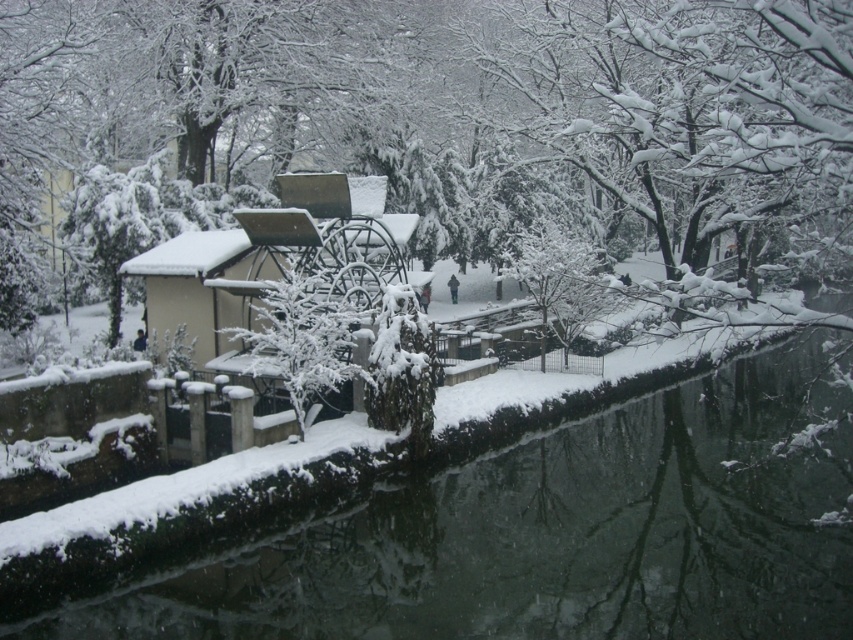
Describe the element at coordinates (555, 536) in the screenshot. I see `snowy concrete river at lower left` at that location.

Can you confirm if snowy concrete river at lower left is thinner than white matte watermill at center?

No, snowy concrete river at lower left is not thinner than white matte watermill at center.

Who is more forward, (637, 580) or (193, 285)?

Point (637, 580) is in front.

Where is `snowy concrete river at lower left`? The height and width of the screenshot is (640, 853). snowy concrete river at lower left is located at coordinates (555, 536).